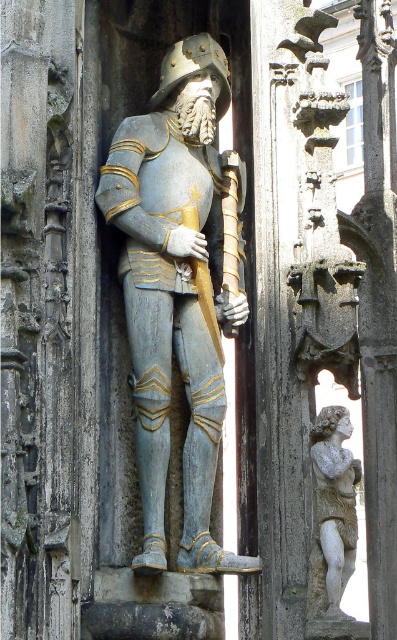
You are an art conservator examining the sculpture. You need to clean the matte blue armor at center and the carved stone cherub at right. Which object is positioned to the left of the other?

The matte blue armor at center is to the left of the carved stone cherub at right.

In the scene shown: You are an art conservator examining the sculpture of the knight. You notice the matte blue armor at center and the carved stone cherub at right. Which object would require a larger protective covering based on their sizes?

The matte blue armor at center is bigger than the carved stone cherub at right, so it would need a larger protective covering.